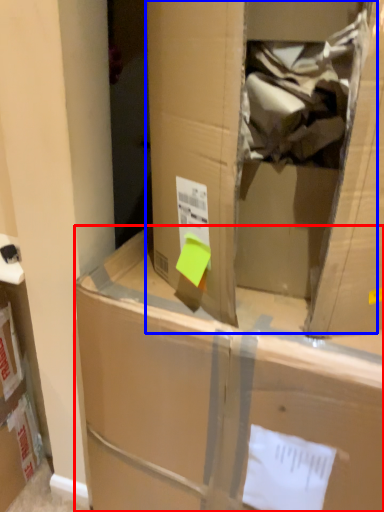
Question: Which point is further to the camera, box (highlighted by a red box) or cardboard box (highlighted by a blue box)?

Choices:
 (A) box
 (B) cardboard box

Answer: (A)